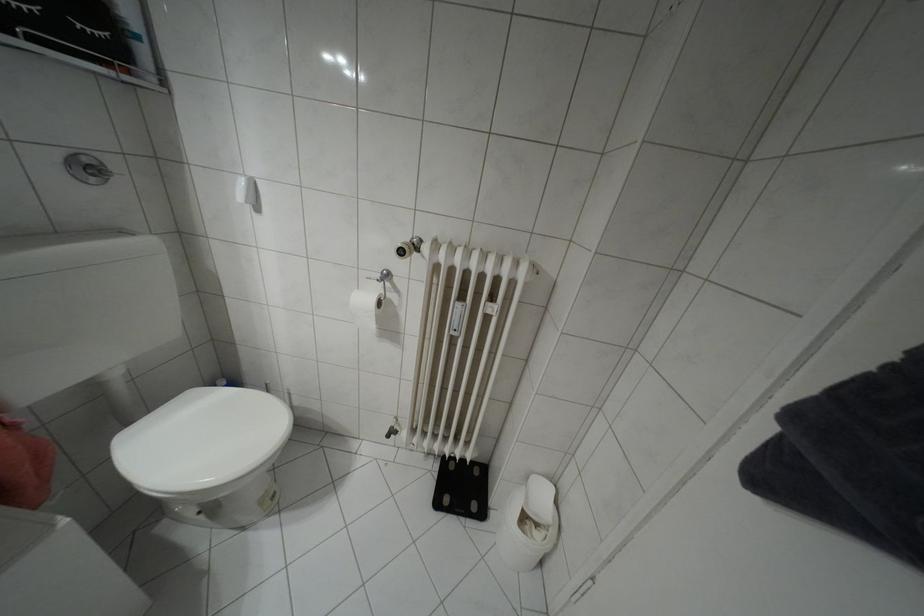
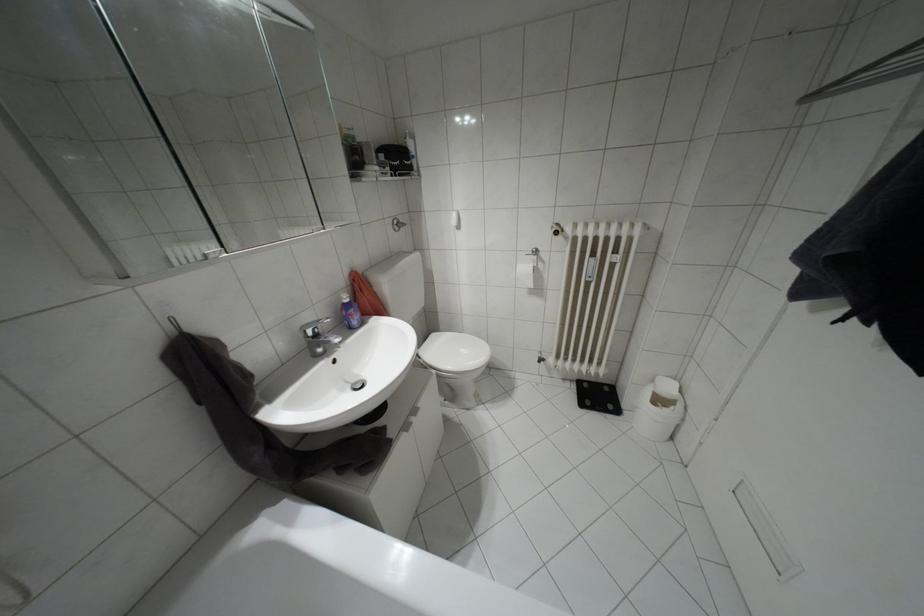
The point at (x=527, y=477) is marked in the first image. Where is the corresponding point in the second image?

(652, 379)